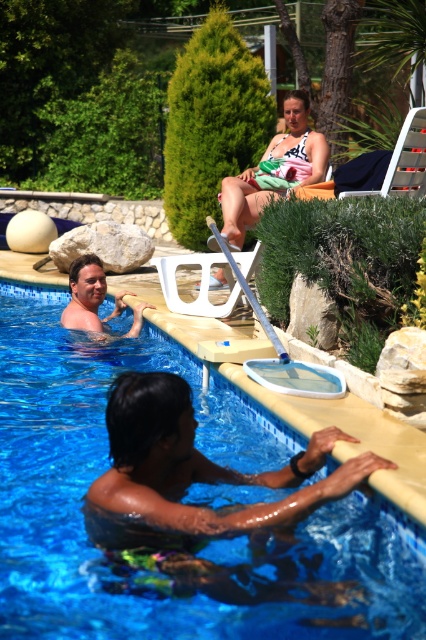
Is blue glossy swimming pool at center thinner than smooth skin man at left?

No, blue glossy swimming pool at center is not thinner than smooth skin man at left.

Can you confirm if blue glossy swimming pool at center is taller than smooth skin man at left?

No.

Identify the location of blue glossy swimming pool at center. (166, 532).

Find the location of `blue glossy swimming pool at center`. blue glossy swimming pool at center is located at coordinates (166, 532).

Looking at this image, between blue glossy swimming pool at center and matte pink bikini top at upper center, which one has less height?

blue glossy swimming pool at center is shorter.

Who is positioned more to the left, blue glossy swimming pool at center or matte pink bikini top at upper center?

From the viewer's perspective, blue glossy swimming pool at center appears more on the left side.

Between point (117, 536) and point (299, 140), which one is positioned behind?

The point (299, 140) is more distant.

You are a GUI agent. You are given a task and a screenshot of the screen. Output one action in this format:
    pyautogui.click(x=<x>, y=<y>)
    Task: Click on the blue glossy swimming pool at center
    This screenshot has width=426, height=640.
    Given the screenshot: What is the action you would take?
    pyautogui.click(x=166, y=532)

Is matte pink bikini top at upper center to the left of smooth skin man at left from the viewer's perspective?

Incorrect, matte pink bikini top at upper center is not on the left side of smooth skin man at left.

Measure the distance between point [291,102] and camera.

Point [291,102] is 8.69 meters away from camera.

Is point (244, 228) in front of point (97, 317)?

No, (244, 228) is further to viewer.

Identify the location of matte pink bikini top at upper center. This screenshot has height=640, width=426. (273, 170).